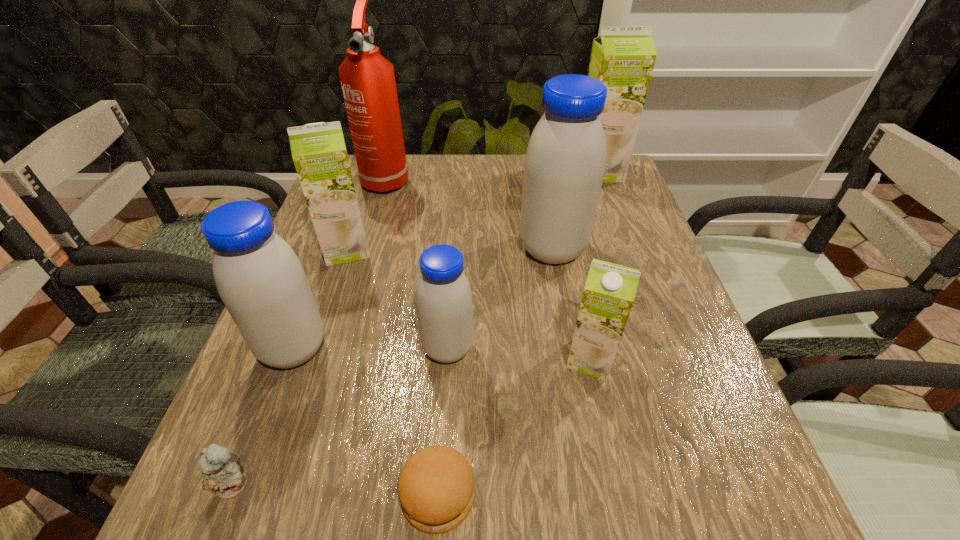
In order to click on object that is positioned at the far left corner in this screenshot , I will do `click(368, 83)`.

Where is `object present at the near left corner`? object present at the near left corner is located at coordinates (219, 474).

Where is `object that is at the far right corner`? The image size is (960, 540). object that is at the far right corner is located at coordinates (622, 58).

I want to click on vacant space at the far edge, so click(417, 195).

Image resolution: width=960 pixels, height=540 pixels. In order to click on free space at the near edge in this screenshot , I will do `click(480, 507)`.

In the image, there is a desktop. Identify the location of free space at the left edge. (315, 293).

At what (x,y) coordinates should I click in order to perform the action: click on vacant space at the right edge. Please return your answer as a coordinate pair (x, y). Looking at the image, I should click on (662, 386).

Find the location of a particular element. The image size is (960, 540). free space at the near left corner is located at coordinates pyautogui.click(x=219, y=525).

Image resolution: width=960 pixels, height=540 pixels. What are the coordinates of `free space at the near right corner` in the screenshot? It's located at (747, 529).

At what (x,y) coordinates should I click in order to perform the action: click on free spot between the teddy bear and the biggest blue soya milk. Please return your answer as a coordinate pair (x, y). Looking at the image, I should click on (394, 367).